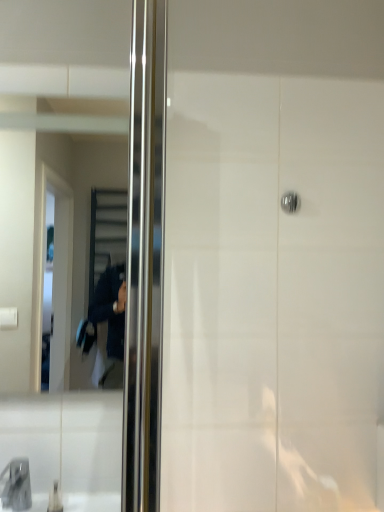
You are a GUI agent. You are given a task and a screenshot of the screen. Output one action in this format:
    pyautogui.click(x=<x>, y=<y>)
    Task: Click on the metallic reflective mirror at left
    Image resolution: width=384 pixels, height=512 pixels.
    Given the screenshot: What is the action you would take?
    pyautogui.click(x=57, y=276)

I want to click on matte gray faucet at lower left, so click(x=16, y=485).

Between metallic reflective mirror at left and satin chrome door handle at upper center, which one appears on the left side from the viewer's perspective?

metallic reflective mirror at left.

Between metallic reflective mirror at left and satin chrome door handle at upper center, which one is positioned in front?

metallic reflective mirror at left is closer to the camera.

Is metallic reflective mirror at left aimed at satin chrome door handle at upper center?

No, metallic reflective mirror at left is not oriented towards satin chrome door handle at upper center.

From a real-world perspective, is metallic reflective mirror at left positioned under satin chrome door handle at upper center based on gravity?

Yes, from a real-world perspective, metallic reflective mirror at left is below satin chrome door handle at upper center.

Considering the sizes of matte gray faucet at lower left and metallic reflective mirror at left in the image, is matte gray faucet at lower left bigger or smaller than metallic reflective mirror at left?

matte gray faucet at lower left is smaller than metallic reflective mirror at left.

Is matte gray faucet at lower left positioned before metallic reflective mirror at left?

Yes, matte gray faucet at lower left is closer to the camera.

This screenshot has width=384, height=512. In order to click on mirror above the matte gray faucet at lower left (from a real-world perspective) in this screenshot , I will do `click(57, 276)`.

From a real-world perspective, which is physically above, matte gray faucet at lower left or metallic reflective mirror at left?

metallic reflective mirror at left is physically above.

What's the angular difference between metallic reflective mirror at left and matte gray faucet at lower left's facing directions?

The angle between the facing direction of metallic reflective mirror at left and the facing direction of matte gray faucet at lower left is 0.000277 degrees.

Is metallic reflective mirror at left far from matte gray faucet at lower left?

No, metallic reflective mirror at left is not far from matte gray faucet at lower left.

Which object is further away from the camera, metallic reflective mirror at left or matte gray faucet at lower left?

Positioned behind is metallic reflective mirror at left.

Considering the points (289, 191) and (69, 10), which point is behind, point (289, 191) or point (69, 10)?

Point (289, 191)

Is satin chrome door handle at upper center wider than metallic reflective mirror at left?

No.

From the image's perspective, is satin chrome door handle at upper center located above metallic reflective mirror at left?

Yes, from the image's perspective, satin chrome door handle at upper center is above metallic reflective mirror at left.

Considering the relative positions of satin chrome door handle at upper center and metallic reflective mirror at left in the image provided, is satin chrome door handle at upper center to the right of metallic reflective mirror at left from the viewer's perspective?

Indeed, satin chrome door handle at upper center is positioned on the right side of metallic reflective mirror at left.

Could you tell me if satin chrome door handle at upper center is turned towards matte gray faucet at lower left?

No, satin chrome door handle at upper center does not turn towards matte gray faucet at lower left.

Does satin chrome door handle at upper center appear on the left side of matte gray faucet at lower left?

No, satin chrome door handle at upper center is not to the left of matte gray faucet at lower left.

Is satin chrome door handle at upper center completely or partially outside of matte gray faucet at lower left?

satin chrome door handle at upper center lies outside matte gray faucet at lower left's area.

Who is smaller, satin chrome door handle at upper center or matte gray faucet at lower left?

satin chrome door handle at upper center is smaller.

Who is more distant, matte gray faucet at lower left or satin chrome door handle at upper center?

satin chrome door handle at upper center is behind.

Is matte gray faucet at lower left smaller than satin chrome door handle at upper center?

Incorrect, matte gray faucet at lower left is not smaller in size than satin chrome door handle at upper center.

Does point (11, 463) lie behind point (282, 202)?

No, it is in front of (282, 202).

Is matte gray faucet at lower left not near satin chrome door handle at upper center?

Yes.

Where is `door handle on the right of metallic reflective mirror at left`? The height and width of the screenshot is (512, 384). door handle on the right of metallic reflective mirror at left is located at coordinates (290, 202).

The height and width of the screenshot is (512, 384). Identify the location of faucet lying below the metallic reflective mirror at left (from the image's perspective). 16,485.

Estimate the real-world distances between objects in this image. Which object is closer to matte gray faucet at lower left, metallic reflective mirror at left or satin chrome door handle at upper center?

metallic reflective mirror at left is positioned closer to the anchor matte gray faucet at lower left.

Looking at the image, which one is located further to matte gray faucet at lower left, satin chrome door handle at upper center or metallic reflective mirror at left?

satin chrome door handle at upper center.

From the image, which object appears to be farther from metallic reflective mirror at left, satin chrome door handle at upper center or matte gray faucet at lower left?

satin chrome door handle at upper center.

Which object lies nearer to the anchor point satin chrome door handle at upper center, metallic reflective mirror at left or matte gray faucet at lower left?

Among the two, metallic reflective mirror at left is located nearer to satin chrome door handle at upper center.

When comparing their distances from satin chrome door handle at upper center, does matte gray faucet at lower left or metallic reflective mirror at left seem closer?

Based on the image, metallic reflective mirror at left appears to be nearer to satin chrome door handle at upper center.

Looking at the image, which one is located closer to metallic reflective mirror at left, matte gray faucet at lower left or satin chrome door handle at upper center?

matte gray faucet at lower left.

This screenshot has height=512, width=384. Find the location of `mirror between matte gray faucet at lower left and satin chrome door handle at upper center`. mirror between matte gray faucet at lower left and satin chrome door handle at upper center is located at coordinates (57, 276).